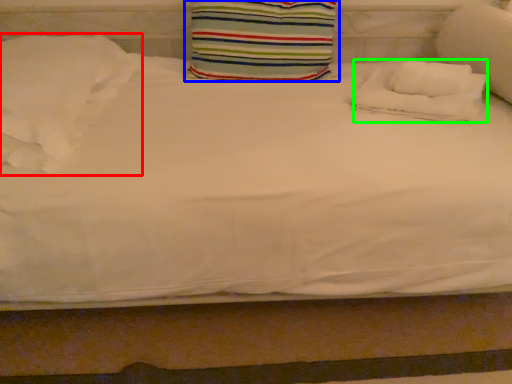
Question: Which object is positioned farthest from pillow (highlighted by a red box)? Select from pillow (highlighted by a blue box) and pillow (highlighted by a green box).

Choices:
 (A) pillow
 (B) pillow

Answer: (B)